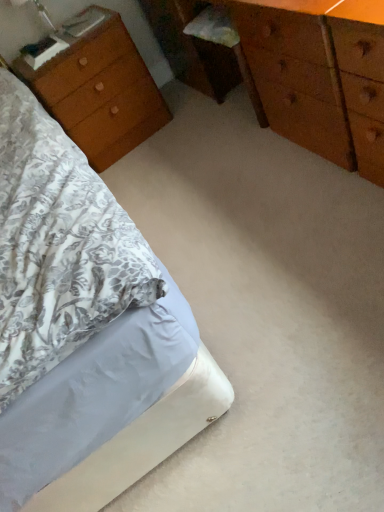
Question: Considering the positions of wooden nightstand at left and white fabric bed at lower left in the image, is wooden nightstand at left bigger or smaller than white fabric bed at lower left?

Choices:
 (A) small
 (B) big

Answer: (A)

Question: From their relative heights in the image, would you say wooden nightstand at left is taller or shorter than white fabric bed at lower left?

Choices:
 (A) short
 (B) tall

Answer: (B)

Question: Estimate the real-world distances between objects in this image. Which object is closer to the wooden chest of drawers at center?

Choices:
 (A) wooden nightstand at left
 (B) white fabric bed at lower left

Answer: (A)

Question: Which is farther from the wooden chest of drawers at center?

Choices:
 (A) white fabric bed at lower left
 (B) wooden nightstand at left

Answer: (A)